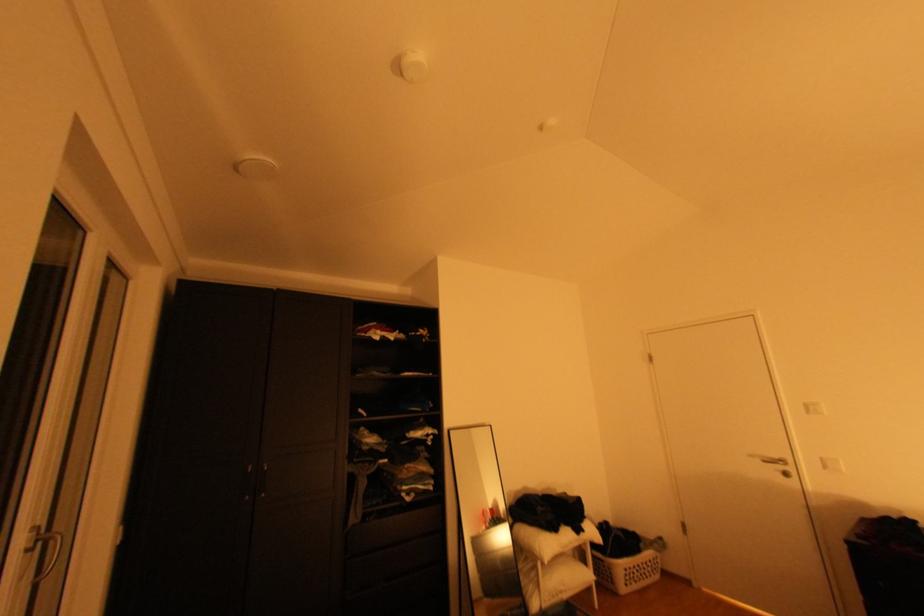
I want to click on white door handle, so click(x=773, y=460).